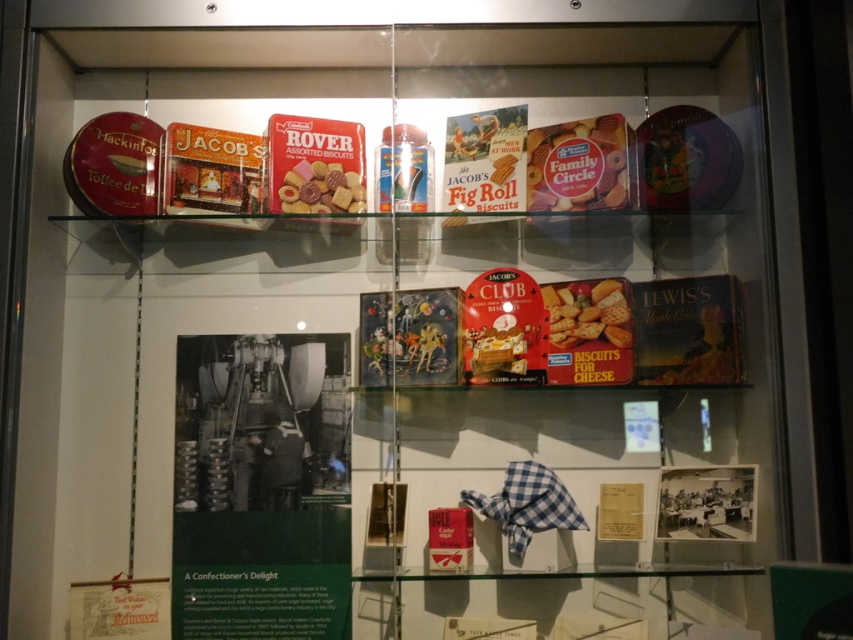
Consider the image. Does matte cardboard biscuit at center have a greater width compared to matte plastic assorted biscuits at upper center?

In fact, matte cardboard biscuit at center might be narrower than matte plastic assorted biscuits at upper center.

Can you confirm if matte cardboard biscuit at center is smaller than matte plastic assorted biscuits at upper center?

No, matte cardboard biscuit at center is not smaller than matte plastic assorted biscuits at upper center.

Where is `matte cardboard biscuit at center`? matte cardboard biscuit at center is located at coordinates (x=587, y=314).

This screenshot has width=853, height=640. Find the location of `matte cardboard biscuit at center`. matte cardboard biscuit at center is located at coordinates (587, 314).

Can you confirm if matte red box at upper center is smaller than matte plastic assorted biscuits at upper center?

No, matte red box at upper center is not smaller than matte plastic assorted biscuits at upper center.

Is matte red box at upper center wider than matte plastic assorted biscuits at upper center?

Correct, the width of matte red box at upper center exceeds that of matte plastic assorted biscuits at upper center.

Where is `matte red box at upper center`? Image resolution: width=853 pixels, height=640 pixels. matte red box at upper center is located at coordinates (578, 164).

You are a GUI agent. You are given a task and a screenshot of the screen. Output one action in this format:
    pyautogui.click(x=<x>, y=<y>)
    Task: Click on the matte red box at upper center
    The image size is (853, 640).
    Given the screenshot: What is the action you would take?
    pyautogui.click(x=578, y=164)

Who is more forward, [601,172] or [622,284]?

Point [601,172] is in front.

Is matte red box at upper center to the left of matte cardboard biscuit at center from the viewer's perspective?

Indeed, matte red box at upper center is positioned on the left side of matte cardboard biscuit at center.

This screenshot has height=640, width=853. Describe the element at coordinates (578, 164) in the screenshot. I see `matte red box at upper center` at that location.

Identify the location of matte red box at upper center. (578, 164).